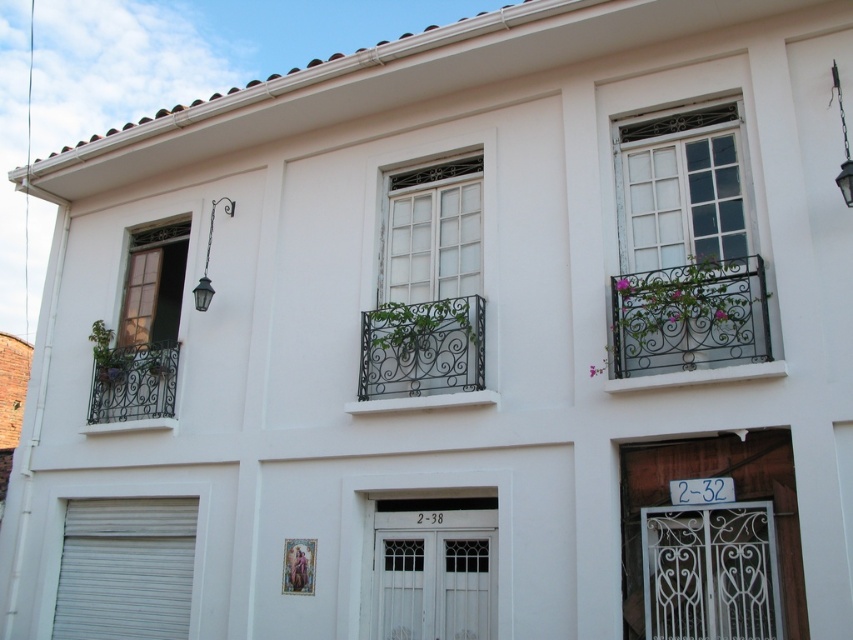
Question: Which of the following is the closest to the observer?

Choices:
 (A) wrought iron balcony at upper right
 (B) white glass window at center

Answer: (A)

Question: Which object is closer to the camera taking this photo?

Choices:
 (A) white painted wood window at upper right
 (B) wrought iron balcony at left
 (C) black wrought iron balcony at center

Answer: (A)

Question: Is white painted wood window at upper right smaller than white glass window at center?

Choices:
 (A) yes
 (B) no

Answer: (B)

Question: Does white painted wood window at upper right appear over wrought iron balcony at left?

Choices:
 (A) no
 (B) yes

Answer: (B)

Question: Which point is farther from the camera taking this photo?

Choices:
 (A) (117, 356)
 (B) (460, 301)
 (C) (167, 304)
 (D) (624, 148)

Answer: (C)

Question: Does white painted wood window at upper right have a lesser width compared to wrought iron balcony at upper right?

Choices:
 (A) no
 (B) yes

Answer: (B)